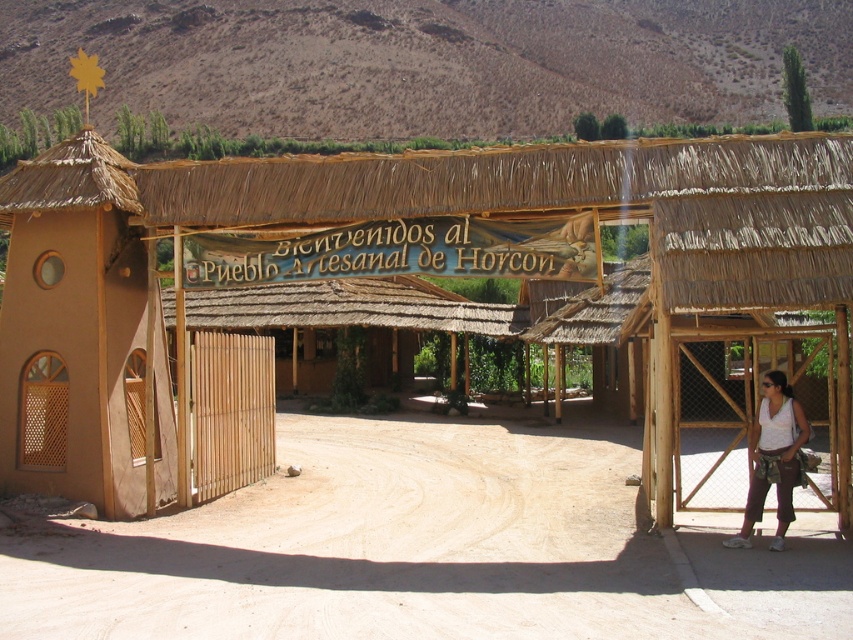
Does thatched straw hut at center come in front of white fabric pants at right?

Yes.

Between thatched straw hut at center and white fabric pants at right, which one is positioned lower?

white fabric pants at right is lower down.

Measure the distance between point (83, 285) and camera.

11.18 meters

Locate an element on the screen. The image size is (853, 640). thatched straw hut at center is located at coordinates (383, 269).

Which is in front, point (593, 477) or point (457, 250)?

Point (457, 250) is in front.

Find the location of `dirt track at center`. dirt track at center is located at coordinates (425, 550).

The width and height of the screenshot is (853, 640). I want to click on dirt track at center, so click(x=425, y=550).

Who is higher up, wooden sign at center or white fabric pants at right?

wooden sign at center is higher up.

Can you confirm if wooden sign at center is smaller than white fabric pants at right?

Incorrect, wooden sign at center is not smaller in size than white fabric pants at right.

Who is more forward, (332,266) or (775,403)?

Point (775,403) is more forward.

The width and height of the screenshot is (853, 640). I want to click on wooden sign at center, so click(399, 252).